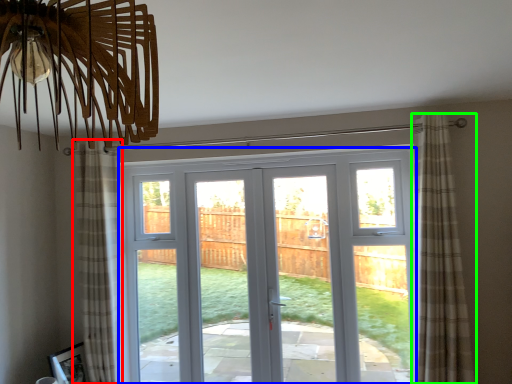
Question: Which object is the closest to the curtain (highlighted by a red box)? Choose among these: door (highlighted by a blue box) or curtain (highlighted by a green box).

Choices:
 (A) door
 (B) curtain

Answer: (B)